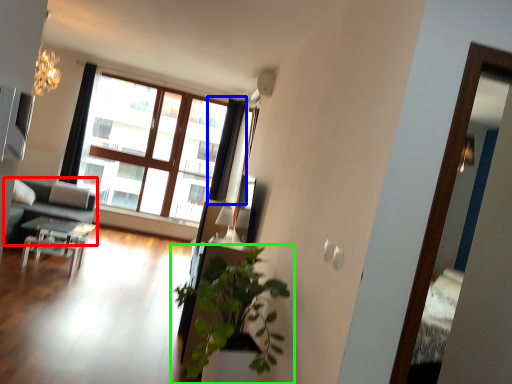
Question: Estimate the real-world distances between objects in this image. Which object is farther from studio couch (highlighted by a red box), curtain (highlighted by a blue box) or houseplant (highlighted by a green box)?

Choices:
 (A) curtain
 (B) houseplant

Answer: (B)